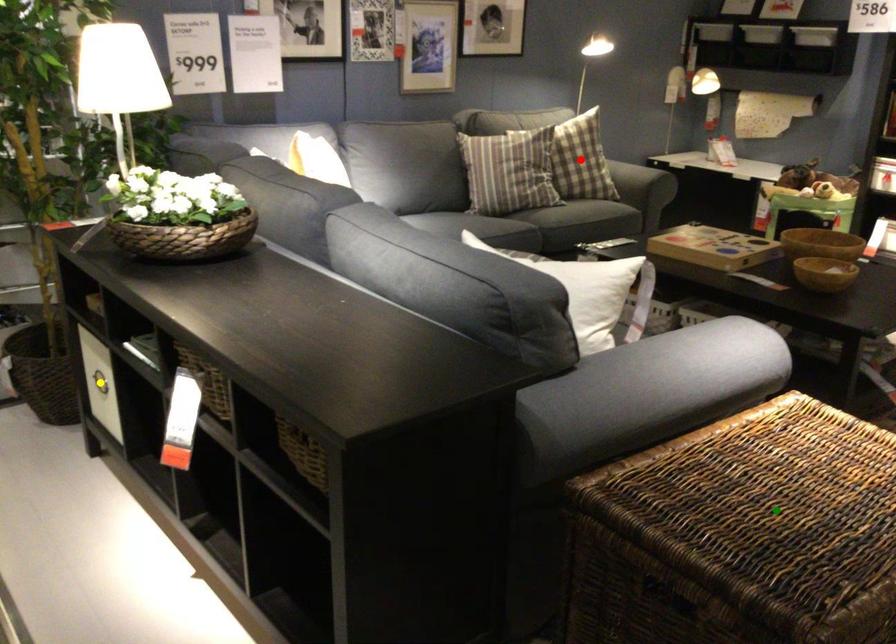
Order these from nearest to farthest:
yellow point | green point | red point

green point, yellow point, red point